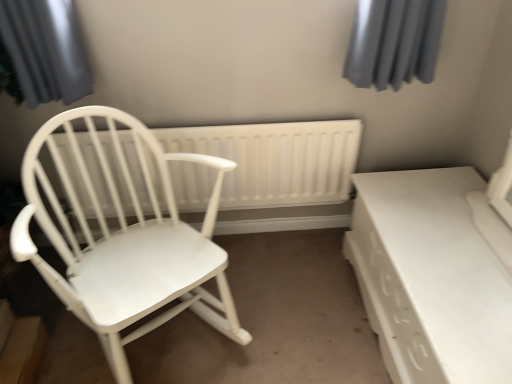
Question: Is white plastic radiator at center taller or shorter than white matte wood chair at left?

Choices:
 (A) tall
 (B) short

Answer: (B)

Question: In terms of width, does white plastic radiator at center look wider or thinner when compared to white matte wood chair at left?

Choices:
 (A) thin
 (B) wide

Answer: (A)

Question: Estimate the real-world distances between objects in this image. Which object is farther from the white glossy table at lower right?

Choices:
 (A) white plastic radiator at center
 (B) white matte wood chair at left

Answer: (B)

Question: Based on their relative distances, which object is farther from the white glossy table at lower right?

Choices:
 (A) white matte wood chair at left
 (B) white plastic radiator at center

Answer: (A)